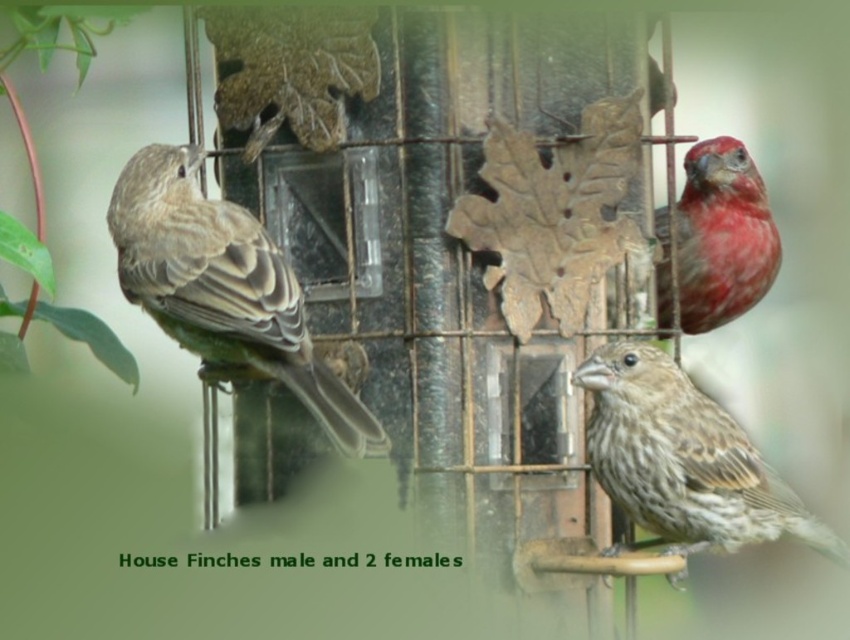
You are a birdwatcher observing the three House Finches on the bird feeder. You notice a brown speckled sparrow at lower right represented by point [683,460]. Is this point closer to the bottom or the top of the feeder?

The brown speckled sparrow at lower right is represented by point [683,460], which is closer to the bottom of the feeder since the y coordinate 0.805 is closer to 1.0, which is the bottom of the image.